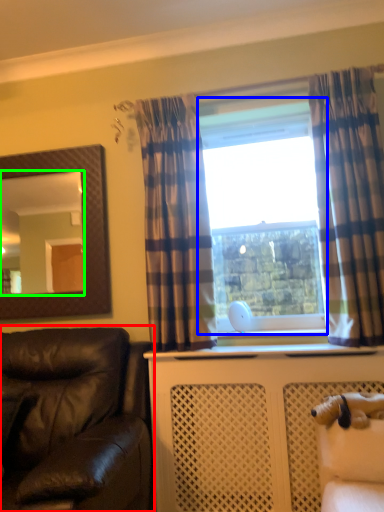
Question: Which object is positioned closest to studio couch (highlighted by a red box)? Select from window frame (highlighted by a blue box) and mirror (highlighted by a green box).

Choices:
 (A) window frame
 (B) mirror

Answer: (A)